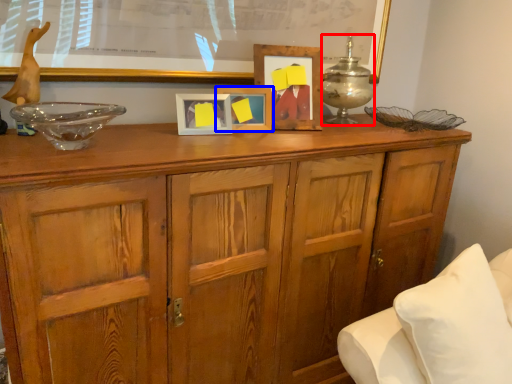
Question: Which of the following is the farthest to the observer, candle holder (highlighted by a red box) or picture frame (highlighted by a blue box)?

Choices:
 (A) candle holder
 (B) picture frame

Answer: (A)